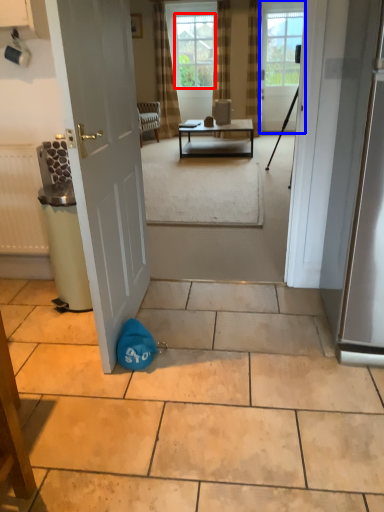
Question: Which object is closer to the camera taking this photo, window screen (highlighted by a red box) or door (highlighted by a blue box)?

Choices:
 (A) window screen
 (B) door

Answer: (B)